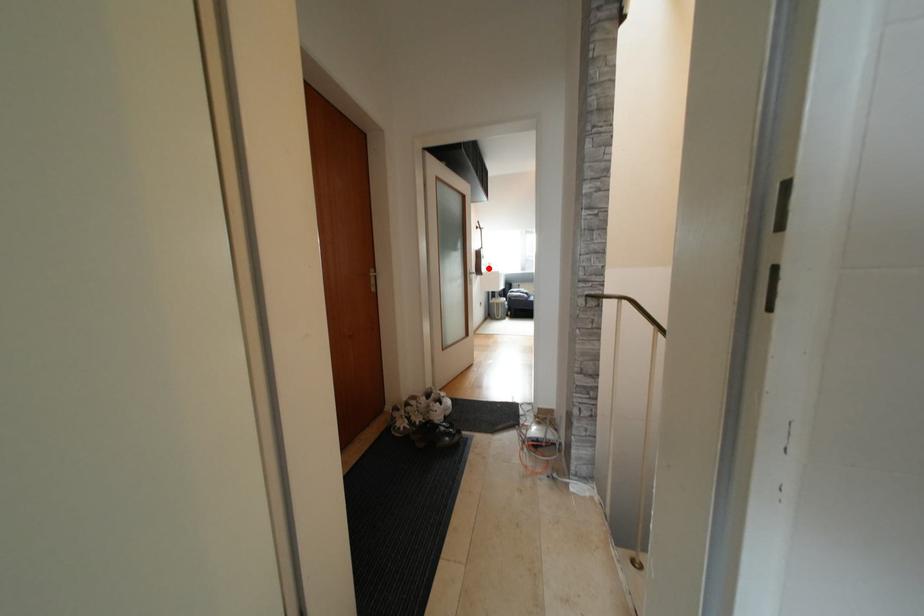
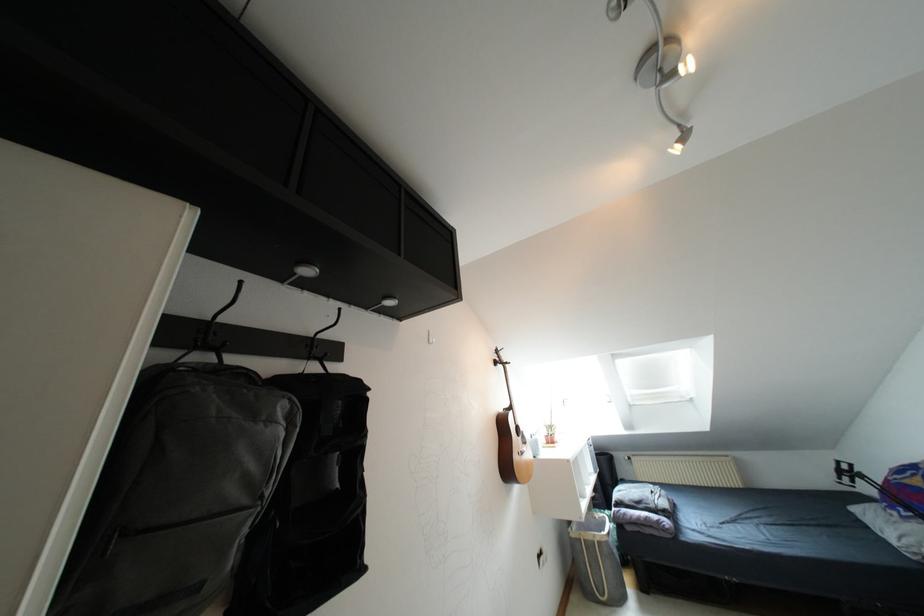
In the second image, find the point that corresponds to the highlighted location in the first image.

(550, 440)